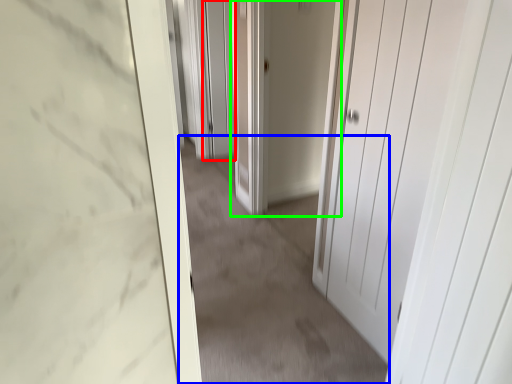
Question: Estimate the real-world distances between objects in this image. Which object is closer to screen door (highlighted by a red box), plain (highlighted by a blue box) or door (highlighted by a green box)?

Choices:
 (A) plain
 (B) door

Answer: (B)